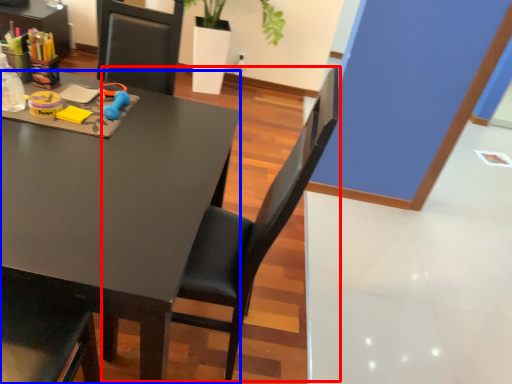
Question: Among these objects, which one is nearest to the camera, chair (highlighted by a red box) or desk (highlighted by a blue box)?

Choices:
 (A) chair
 (B) desk

Answer: (A)